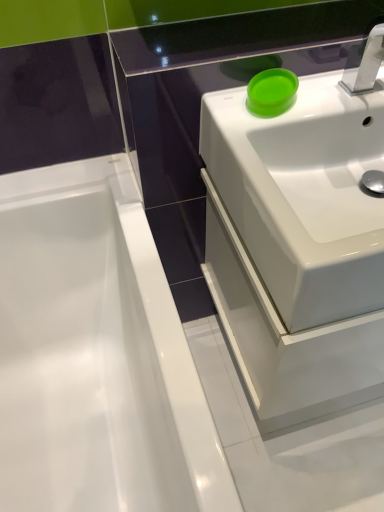
Question: Based on their sizes in the image, would you say white glossy sink at upper right is bigger or smaller than silver metallic tap at upper right?

Choices:
 (A) small
 (B) big

Answer: (B)

Question: From a real-world perspective, is white glossy sink at upper right positioned above or below silver metallic tap at upper right?

Choices:
 (A) above
 (B) below

Answer: (B)

Question: Based on their relative distances, which object is farther from the matte green bowl at upper right?

Choices:
 (A) silver metallic tap at upper right
 (B) white glossy bathtub at left
 (C) white glossy sink at upper right

Answer: (B)

Question: Estimate the real-world distances between objects in this image. Which object is farther from the silver metallic tap at upper right?

Choices:
 (A) white glossy sink at upper right
 (B) matte green bowl at upper right
 (C) white glossy bathtub at left

Answer: (C)